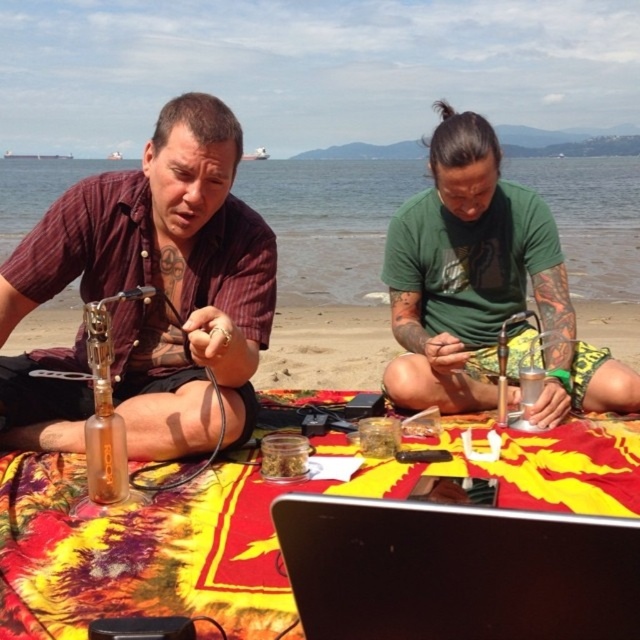
You are a GUI agent. You are given a task and a screenshot of the screen. Output one action in this format:
    pyautogui.click(x=<x>, y=<y>)
    Task: Click on the black matte laptop at lower center
    Image resolution: width=640 pixels, height=640 pixels.
    Given the screenshot: What is the action you would take?
    pyautogui.click(x=456, y=570)

Between point (561, 566) and point (477, 154), which one is positioned behind?

The point (477, 154) is more distant.

This screenshot has height=640, width=640. What are the coordinates of `black matte laptop at lower center` in the screenshot? It's located at (456, 570).

Does tie-dye fabric at center have a greater width compared to black matte laptop at lower center?

Indeed, tie-dye fabric at center has a greater width compared to black matte laptop at lower center.

Who is positioned more to the left, tie-dye fabric at center or black matte laptop at lower center?

tie-dye fabric at center is more to the left.

You are a GUI agent. You are given a task and a screenshot of the screen. Output one action in this format:
    pyautogui.click(x=<x>, y=<y>)
    Task: Click on the tie-dye fabric at center
    The width and height of the screenshot is (640, 640).
    Given the screenshot: What is the action you would take?
    pyautogui.click(x=252, y=525)

Describe the element at coordinates (163, 276) in the screenshot. The height and width of the screenshot is (640, 640). I see `matte brown shirt at left` at that location.

You are a GUI agent. You are given a task and a screenshot of the screen. Output one action in this format:
    pyautogui.click(x=<x>, y=<y>)
    Task: Click on the matte brown shirt at left
    
    Given the screenshot: What is the action you would take?
    pyautogui.click(x=163, y=276)